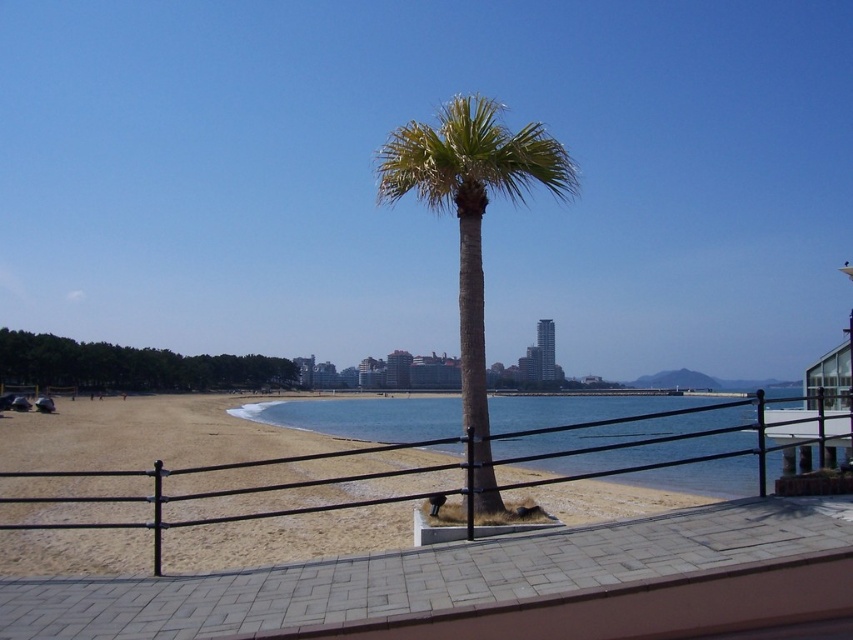
Which is below, black metal fence at center or green leafy palm tree at center?

black metal fence at center is below.

Describe the element at coordinates (148, 435) in the screenshot. This screenshot has width=853, height=640. I see `black metal fence at center` at that location.

Is point (115, 477) closer to viewer compared to point (462, 202)?

No, (115, 477) is behind (462, 202).

In order to click on black metal fence at center in this screenshot , I will do `click(148, 435)`.

Which is below, black metal fence at center or clear blue water at center?

clear blue water at center

Who is positioned more to the right, black metal fence at center or clear blue water at center?

Positioned to the right is clear blue water at center.

Identify the location of black metal fence at center. (148, 435).

You are a GUI agent. You are given a task and a screenshot of the screen. Output one action in this format:
    pyautogui.click(x=<x>, y=<y>)
    Task: Click on the black metal fence at center
    The image size is (853, 640).
    Given the screenshot: What is the action you would take?
    pyautogui.click(x=148, y=435)

Is clear blue water at center taller than green leafy palm tree at center?

Incorrect, clear blue water at center's height is not larger of green leafy palm tree at center's.

Which is more to the left, clear blue water at center or green leafy palm tree at center?

green leafy palm tree at center is more to the left.

Identify the location of clear blue water at center. This screenshot has width=853, height=640. (363, 417).